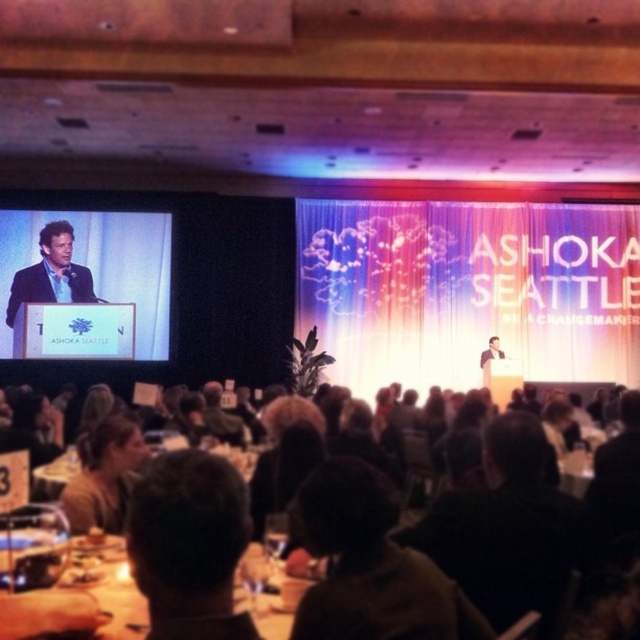
You are an event planner setting up a microphone stand for the keynote speaker. The stand requires a space of 1.2 meters in width. You have two options to place it either on the wooden table at lower center or next to the matte black suit at center. Based on the scene, which location has enough space for the microphone stand?

The wooden table at lower center has a width larger than the matte black suit at center, so placing the microphone stand on the wooden table at lower center would provide sufficient space as it is wider than 1.2 meters.

In the scene shown: You are an attendee at the ASHOKA SEATTLE event and need to place your name tag on the wooden table at lower center. Where exactly should you place it on the table?

The wooden table at lower center is located at point [81,602], so you should place your name tag at that specific coordinate on the table.

You are an attendee at the event and want to take a photo of the dark brown hair at center and the wooden table at lower center. Which object should you focus on first to ensure both are in frame?

You should focus on the wooden table at lower center first because the dark brown hair at center is in front of it, ensuring both will be visible in the photo when the table is in frame.